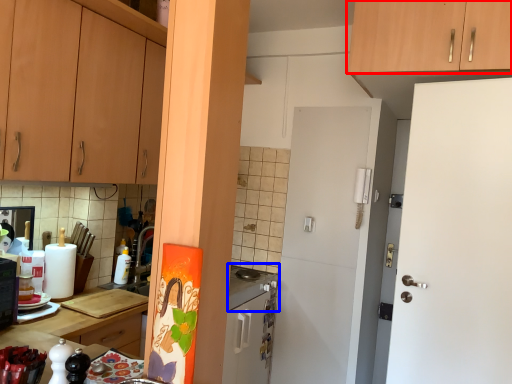
Question: Which object appears closest to the camera in this image, cabinetry (highlighted by a red box) or gas stove (highlighted by a blue box)?

Choices:
 (A) cabinetry
 (B) gas stove

Answer: (A)